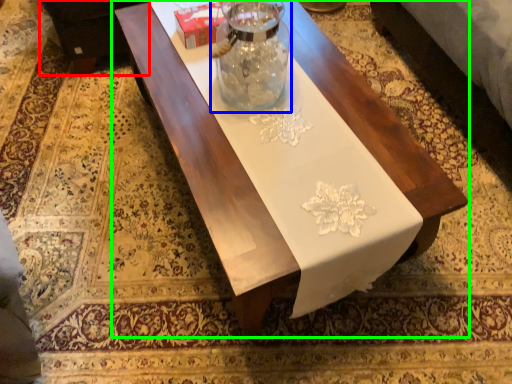
Question: Based on their relative distances, which object is nearer to couch (highlighted by a red box)? Choose from glass vase (highlighted by a blue box) and table (highlighted by a green box).

Choices:
 (A) glass vase
 (B) table

Answer: (B)